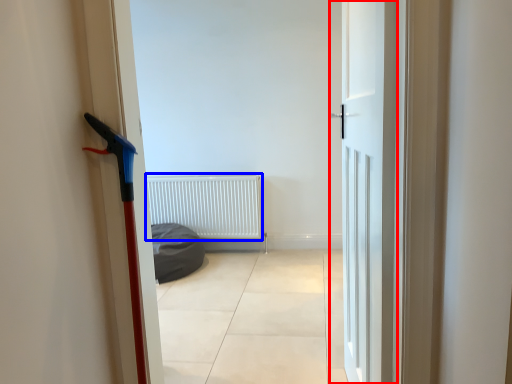
Question: Which point is further to the camera, door (highlighted by a red box) or radiator (highlighted by a blue box)?

Choices:
 (A) door
 (B) radiator

Answer: (B)